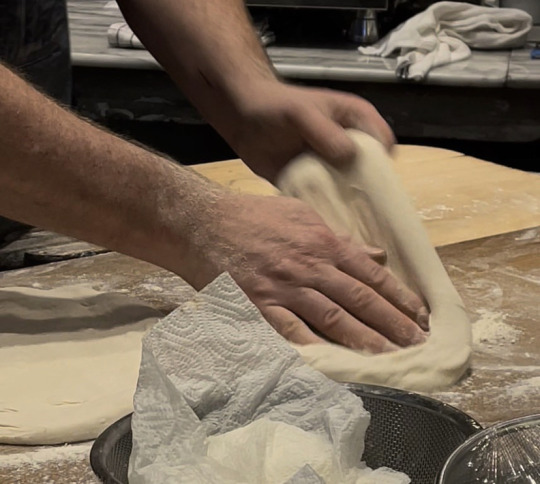
I want to click on towels, so click(431, 45), click(128, 41).